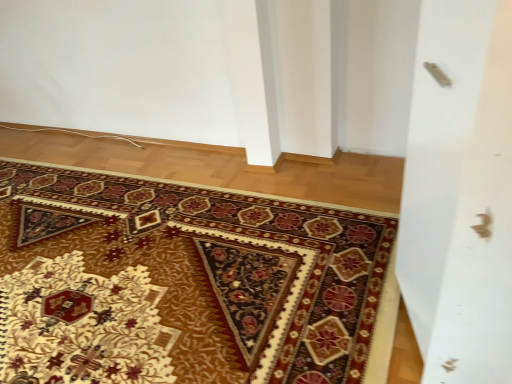
What do you see at coordinates (182, 283) in the screenshot? Image resolution: width=512 pixels, height=384 pixels. I see `carpet with intricate patterns at center` at bounding box center [182, 283].

In order to face carpet with intricate patterns at center, should I rotate leftwards or rightwards?

Turn left approximately 21.565 degrees to face it.

Find the location of `carpet with intricate patterns at center`. carpet with intricate patterns at center is located at coordinates coord(182,283).

What are the coordinates of `silver metallic screen door at upper right` in the screenshot? It's located at (438, 147).

Describe the element at coordinates (438, 147) in the screenshot. Image resolution: width=512 pixels, height=384 pixels. I see `silver metallic screen door at upper right` at that location.

At what (x,y) coordinates should I click in order to perform the action: click on carpet with intricate patterns at center. Please return your answer as a coordinate pair (x, y). The image size is (512, 384). Looking at the image, I should click on (182, 283).

Can you confirm if carpet with intricate patterns at center is positioned to the right of silver metallic screen door at upper right?

No, carpet with intricate patterns at center is not to the right of silver metallic screen door at upper right.

From the picture: Between carpet with intricate patterns at center and silver metallic screen door at upper right, which one is positioned behind?

carpet with intricate patterns at center is further from the camera.

Which is more distant, (144,333) or (429,216)?

The point (144,333) is farther.

From the image's perspective, is carpet with intricate patterns at center located beneath silver metallic screen door at upper right?

Yes, from the image's perspective, carpet with intricate patterns at center is beneath silver metallic screen door at upper right.

From a real-world perspective, is carpet with intricate patterns at center located beneath silver metallic screen door at upper right?

Yes.

Looking at their sizes, would you say carpet with intricate patterns at center is wider or thinner than silver metallic screen door at upper right?

Clearly, carpet with intricate patterns at center has more width compared to silver metallic screen door at upper right.

Is carpet with intricate patterns at center taller or shorter than silver metallic screen door at upper right?

carpet with intricate patterns at center is shorter than silver metallic screen door at upper right.

Considering the sizes of objects carpet with intricate patterns at center and silver metallic screen door at upper right in the image provided, who is smaller, carpet with intricate patterns at center or silver metallic screen door at upper right?

carpet with intricate patterns at center is smaller.

Is carpet with intricate patterns at center situated inside silver metallic screen door at upper right or outside?

carpet with intricate patterns at center is located beyond the bounds of silver metallic screen door at upper right.

Are carpet with intricate patterns at center and silver metallic screen door at upper right located far from each other?

No, there isn't a large distance between carpet with intricate patterns at center and silver metallic screen door at upper right.

Is carpet with intricate patterns at center aimed at silver metallic screen door at upper right?

No, carpet with intricate patterns at center is not turned towards silver metallic screen door at upper right.

Can you tell me how much carpet with intricate patterns at center and silver metallic screen door at upper right differ in facing direction?

There is a 179-degree angle between the facing directions of carpet with intricate patterns at center and silver metallic screen door at upper right.

Identify the location of screen door in front of the carpet with intricate patterns at center. This screenshot has height=384, width=512. (438, 147).

Considering the relative positions of silver metallic screen door at upper right and carpet with intricate patterns at center in the image provided, is silver metallic screen door at upper right to the left or to the right of carpet with intricate patterns at center?

Clearly, silver metallic screen door at upper right is on the right of carpet with intricate patterns at center in the image.

Is the position of silver metallic screen door at upper right more distant than that of carpet with intricate patterns at center?

No, it is not.

Is point (412, 298) closer or farther from the camera than point (94, 354)?

Point (412, 298) is positioned closer to the camera compared to point (94, 354).

From the image's perspective, which one is positioned lower, silver metallic screen door at upper right or carpet with intricate patterns at center?

carpet with intricate patterns at center appears lower in the image.

From the picture: From a real-world perspective, which is physically below, silver metallic screen door at upper right or carpet with intricate patterns at center?

From a 3D spatial view, carpet with intricate patterns at center is below.

Can you confirm if silver metallic screen door at upper right is thinner than carpet with intricate patterns at center?

Yes.

Between silver metallic screen door at upper right and carpet with intricate patterns at center, which one has more height?

silver metallic screen door at upper right is taller.

Is silver metallic screen door at upper right bigger than carpet with intricate patterns at center?

Yes.

Choose the correct answer: Is silver metallic screen door at upper right inside carpet with intricate patterns at center or outside it?

silver metallic screen door at upper right is not inside carpet with intricate patterns at center, it's outside.

From the picture: Are silver metallic screen door at upper right and carpet with intricate patterns at center far apart?

No, silver metallic screen door at upper right is not far away from carpet with intricate patterns at center.

Is silver metallic screen door at upper right positioned with its back to carpet with intricate patterns at center?

No, silver metallic screen door at upper right's orientation is not away from carpet with intricate patterns at center.

Measure the distance between silver metallic screen door at upper right and carpet with intricate patterns at center.

silver metallic screen door at upper right and carpet with intricate patterns at center are 87.75 centimeters apart from each other.

Where is `mat behind the silver metallic screen door at upper right`? mat behind the silver metallic screen door at upper right is located at coordinates (182, 283).

This screenshot has height=384, width=512. I want to click on mat located underneath the silver metallic screen door at upper right (from a real-world perspective), so click(x=182, y=283).

There is a carpet with intricate patterns at center. In order to click on screen door above it (from a real-world perspective) in this screenshot , I will do `click(438, 147)`.